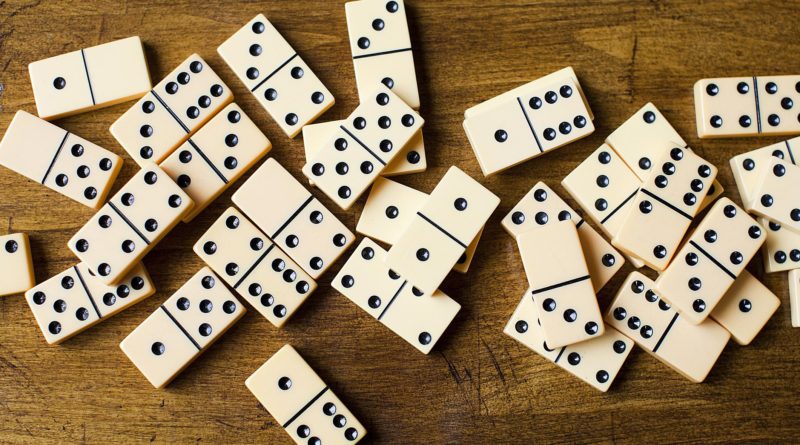
You are a GUI agent. You are given a task and a screenshot of the screen. Output one action in this format:
    pyautogui.click(x=<x>, y=<y>)
    Task: Click on the domino pieces on top of other pieces
    
    Given the screenshot: What is the action you would take?
    pyautogui.click(x=138, y=217), pyautogui.click(x=344, y=153), pyautogui.click(x=436, y=235), pyautogui.click(x=509, y=125), pyautogui.click(x=572, y=259), pyautogui.click(x=692, y=264), pyautogui.click(x=665, y=210), pyautogui.click(x=778, y=181)